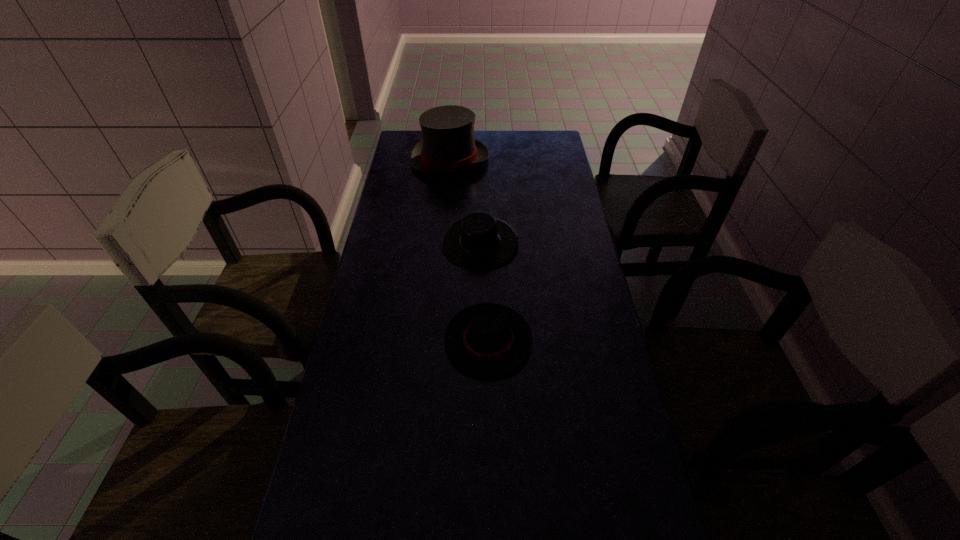
The width and height of the screenshot is (960, 540). In order to click on object that is at the far left corner in this screenshot , I will do `click(448, 145)`.

Identify the location of free point at the far edge. (525, 157).

Locate an element on the screen. The image size is (960, 540). vacant area at the left edge is located at coordinates (415, 279).

This screenshot has height=540, width=960. What are the coordinates of `vacant space at the right edge of the desktop` in the screenshot? It's located at (552, 211).

You are a GUI agent. You are given a task and a screenshot of the screen. Output one action in this format:
    pyautogui.click(x=<x>, y=<y>)
    Task: Click on the vacant region at the far right corner of the desktop
    This screenshot has height=540, width=960.
    Given the screenshot: What is the action you would take?
    pyautogui.click(x=560, y=150)

Where is `vacant space that is in between the nearest dress hat and the second farthest object`? The image size is (960, 540). vacant space that is in between the nearest dress hat and the second farthest object is located at coordinates (484, 292).

What are the coordinates of `empty space that is in between the farthest object and the second farthest object` in the screenshot? It's located at click(x=465, y=202).

Where is `free area in between the third nearest object and the tallest object`? free area in between the third nearest object and the tallest object is located at coordinates (465, 202).

At what (x,y) coordinates should I click in order to perform the action: click on vacant area that lies between the farthest object and the third nearest object. Please return your answer as a coordinate pair (x, y). Looking at the image, I should click on (465, 202).

Identify the location of empty location between the third tallest object and the third nearest object. This screenshot has height=540, width=960. (484, 292).